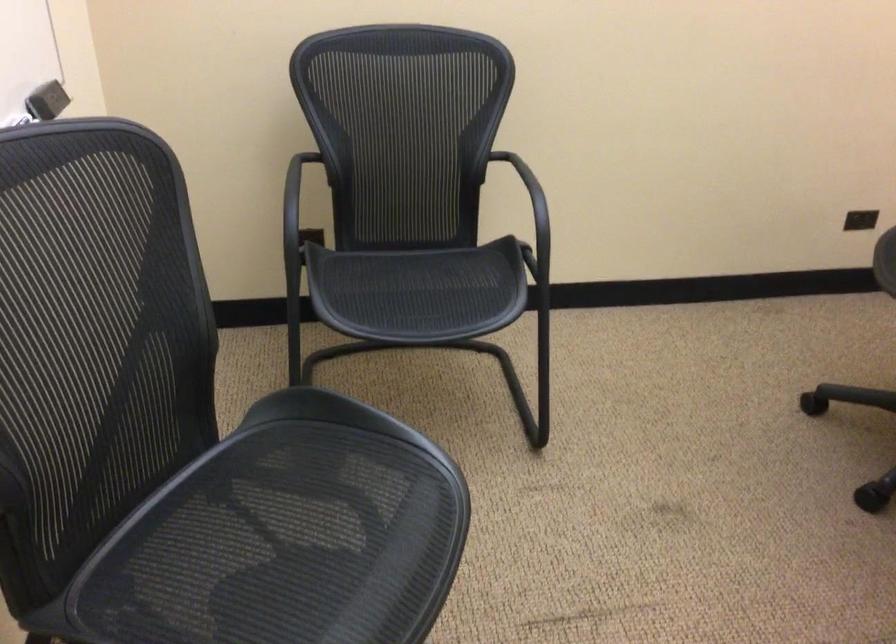
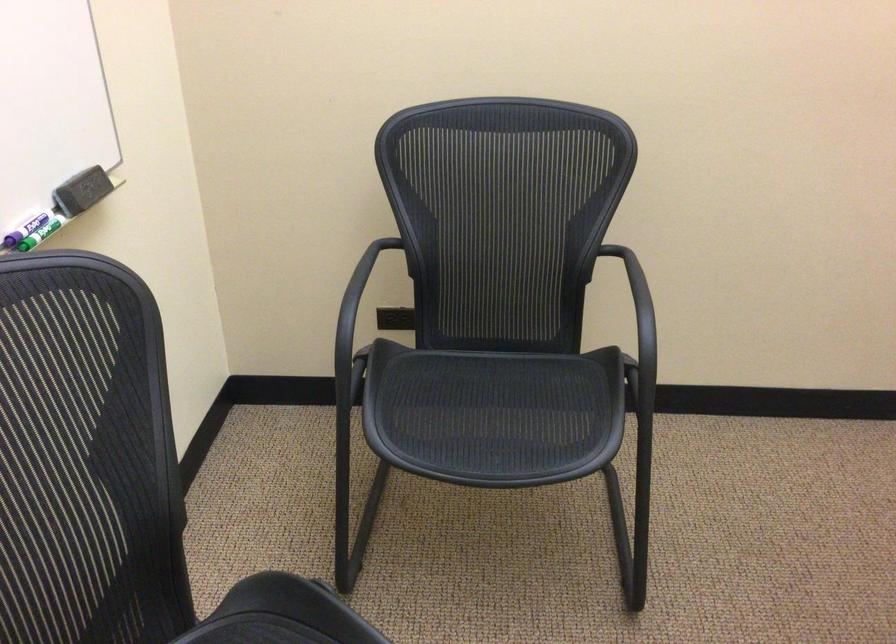
The point at [540,227] is marked in the first image. Where is the corresponding point in the second image?

(639, 348)